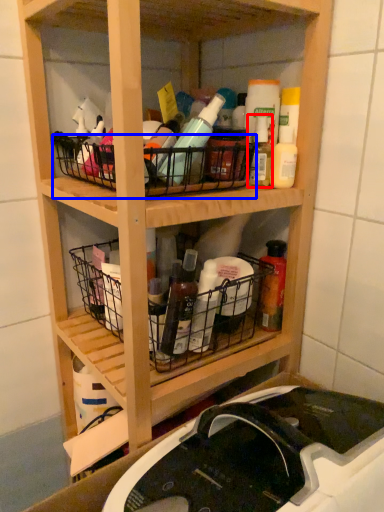
Question: Which object is further to the camera taking this photo, bottle (highlighted by a red box) or basket (highlighted by a blue box)?

Choices:
 (A) bottle
 (B) basket

Answer: (A)